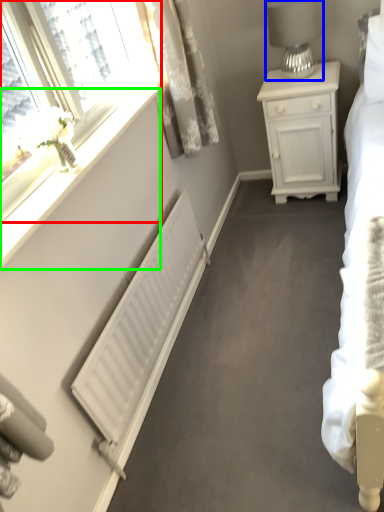
Question: Considering the real-world distances, which object is closest to window (highlighted by a red box)? table lamp (highlighted by a blue box) or window sill (highlighted by a green box).

Choices:
 (A) table lamp
 (B) window sill

Answer: (B)